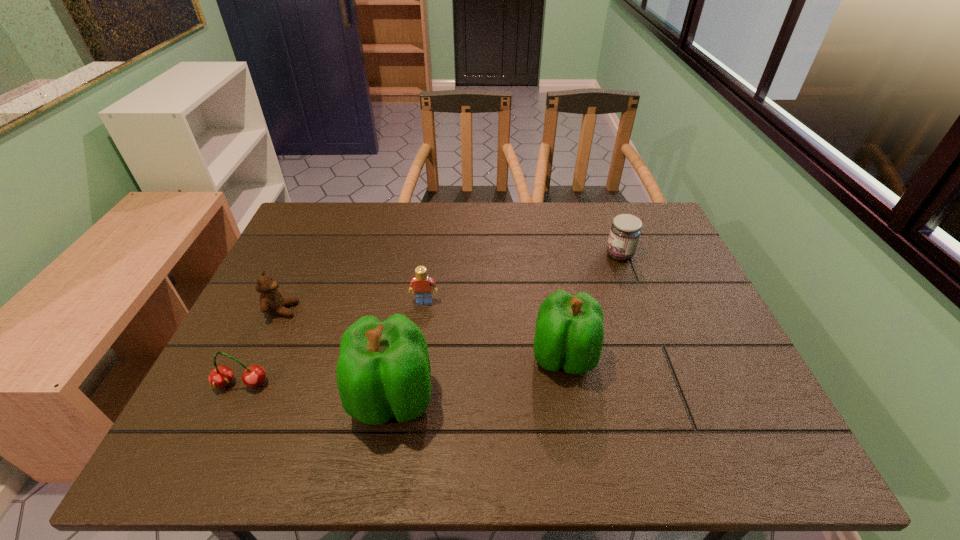
Locate an element on the screen. object at the right edge is located at coordinates (625, 231).

I want to click on object positioned at the near left corner, so click(220, 377).

The height and width of the screenshot is (540, 960). In order to click on object that is at the far right corner in this screenshot , I will do `click(625, 231)`.

The image size is (960, 540). I want to click on vacant region at the far edge of the desktop, so click(375, 212).

You are a GUI agent. You are given a task and a screenshot of the screen. Output one action in this format:
    pyautogui.click(x=<x>, y=<y>)
    Task: Click on the free space at the left edge
    The image size is (960, 540).
    Given the screenshot: What is the action you would take?
    pyautogui.click(x=291, y=309)

At what (x,y) coordinates should I click in order to perform the action: click on vacant space at the right edge of the desktop. Please return your answer as a coordinate pair (x, y). The image size is (960, 540). Looking at the image, I should click on (726, 360).

Where is `vacant area at the far left corner of the desktop`? vacant area at the far left corner of the desktop is located at coordinates (322, 223).

The height and width of the screenshot is (540, 960). Identify the location of vacant space at the near right corner of the desktop. (742, 388).

You are a GUI agent. You are given a task and a screenshot of the screen. Output one action in this format:
    pyautogui.click(x=<x>, y=<y>)
    Task: Click on the free space between the cherry and the farthest object
    
    Given the screenshot: What is the action you would take?
    pyautogui.click(x=430, y=320)

You are a GUI agent. You are given a task and a screenshot of the screen. Output one action in this format:
    pyautogui.click(x=<x>, y=<y>)
    Task: Click on the vacant region between the teddy bear and the rightmost object
    This screenshot has height=540, width=960.
    Given the screenshot: What is the action you would take?
    pyautogui.click(x=451, y=282)